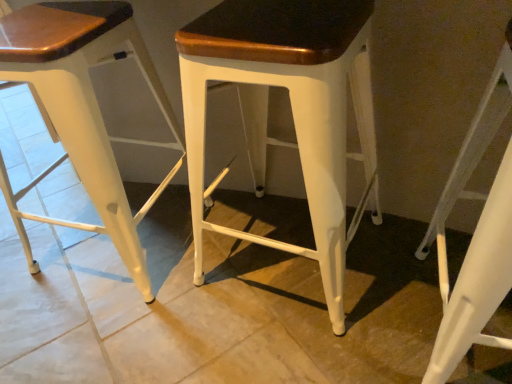
Question: Should I look upward or downward to see white matte stool at lower right, which is the 1th stool in right-to-left order?

Choices:
 (A) down
 (B) up

Answer: (A)

Question: From the image's perspective, does white matte stool at center, positioned as the 2th stool in right-to-left order, appear lower than white metal stool at center, which is the first stool in left-to-right order?

Choices:
 (A) no
 (B) yes

Answer: (B)

Question: Is white matte stool at center, positioned as the 2th stool in right-to-left order, bigger than white metal stool at center, which is the first stool in left-to-right order?

Choices:
 (A) yes
 (B) no

Answer: (B)

Question: From a real-world perspective, is white matte stool at center, marked as the 2th stool in a left-to-right arrangement, below white metal stool at center, which is the first stool in left-to-right order?

Choices:
 (A) yes
 (B) no

Answer: (B)

Question: Is white matte stool at center, positioned as the 2th stool in right-to-left order, smaller than white metal stool at center, which is counted as the third stool, starting from the right?

Choices:
 (A) no
 (B) yes

Answer: (B)

Question: Is white matte stool at center, positioned as the 2th stool in right-to-left order, placed right next to white metal stool at center, which is the first stool in left-to-right order?

Choices:
 (A) no
 (B) yes

Answer: (A)

Question: Does white matte stool at center, marked as the 2th stool in a left-to-right arrangement, contain white metal stool at center, which is counted as the third stool, starting from the right?

Choices:
 (A) yes
 (B) no

Answer: (B)

Question: From a real-world perspective, is white matte stool at lower right, which is the 1th stool in right-to-left order, beneath white metal stool at center, which is counted as the third stool, starting from the right?

Choices:
 (A) yes
 (B) no

Answer: (A)

Question: Considering the relative positions of white matte stool at lower right, which is the 1th stool in right-to-left order, and white metal stool at center, which is counted as the third stool, starting from the right, in the image provided, is white matte stool at lower right, which is the 1th stool in right-to-left order, to the left of white metal stool at center, which is counted as the third stool, starting from the right, from the viewer's perspective?

Choices:
 (A) yes
 (B) no

Answer: (B)

Question: From a real-world perspective, is white matte stool at lower right, positioned as the 3th stool in left-to-right order, located higher than white metal stool at center, which is the first stool in left-to-right order?

Choices:
 (A) no
 (B) yes

Answer: (A)

Question: Is the position of white matte stool at lower right, positioned as the 3th stool in left-to-right order, more distant than that of white metal stool at center, which is the first stool in left-to-right order?

Choices:
 (A) yes
 (B) no

Answer: (B)

Question: Is white matte stool at lower right, positioned as the 3th stool in left-to-right order, touching white metal stool at center, which is counted as the third stool, starting from the right?

Choices:
 (A) yes
 (B) no

Answer: (B)

Question: From the image's perspective, is white matte stool at lower right, positioned as the 3th stool in left-to-right order, on white metal stool at center, which is the first stool in left-to-right order?

Choices:
 (A) no
 (B) yes

Answer: (A)

Question: Is white metal stool at center, which is the first stool in left-to-right order, taller than white matte stool at lower right, which is the 1th stool in right-to-left order?

Choices:
 (A) yes
 (B) no

Answer: (A)